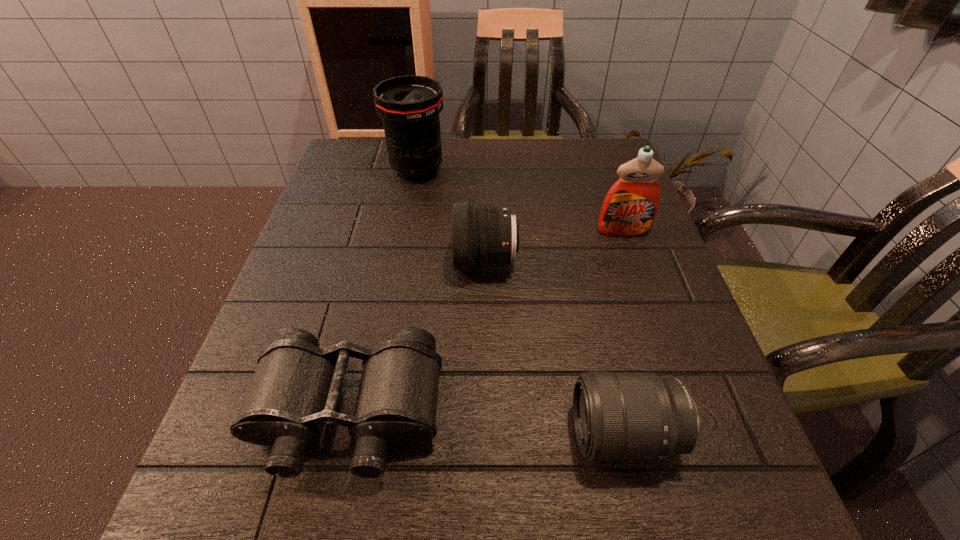
Select which telephoto lens is the second closest to the third object from left to right. Please provide its 2D coordinates. Your answer should be formatted as a tuple, i.e. [(x, y)], where the tuple contains the x and y coordinates of a point satisfying the conditions above.

[(618, 416)]

The width and height of the screenshot is (960, 540). I want to click on telephoto lens identified as the closest to the binoculars, so coord(483,236).

Locate an element on the screen. Image resolution: width=960 pixels, height=540 pixels. vacant space that satisfies the following two spatial constraints: 1. on the front surface of the fourth nearest object; 2. on the surface of the rightmost telephoto lens is located at coordinates (695, 435).

The image size is (960, 540). In order to click on free location that satisfies the following two spatial constraints: 1. at the front element of the third object from left to right; 2. through the eyepieces of the binoculars in this screenshot , I will do `click(488, 413)`.

Where is `free region that satisfies the following two spatial constraints: 1. on the front surface of the fourth nearest object; 2. on the surface of the rightmost telephoto lens`? Image resolution: width=960 pixels, height=540 pixels. free region that satisfies the following two spatial constraints: 1. on the front surface of the fourth nearest object; 2. on the surface of the rightmost telephoto lens is located at coordinates (695, 435).

What are the coordinates of `vacant space that satisfies the following two spatial constraints: 1. at the front element of the second telephoto lens from left to right; 2. through the eyepieces of the shortest object` in the screenshot? It's located at (488, 413).